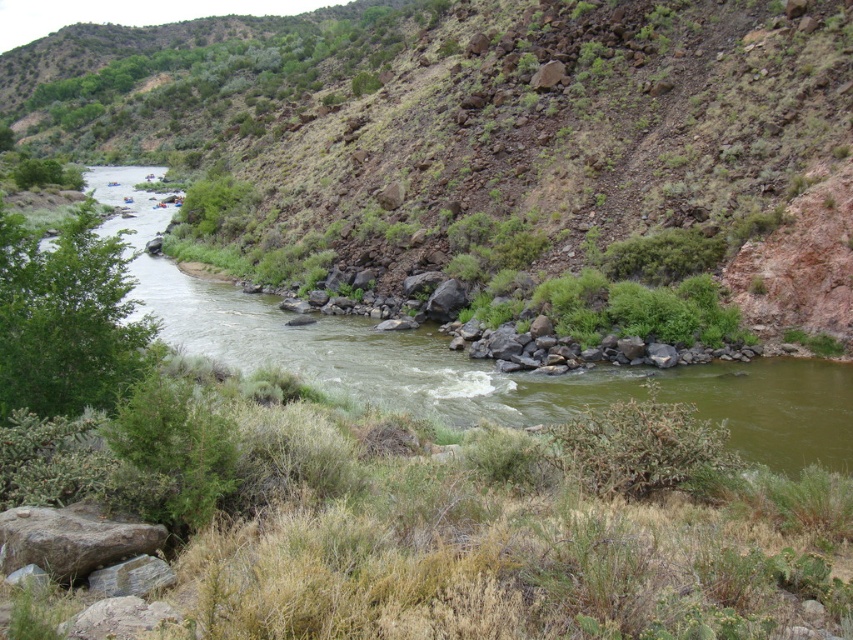
You are planning to cross the river using a small boat. You see the green grassy hillside at upper left and the green water at left. Which direction should you head towards to avoid the rapids near the center?

You should head towards the green grassy hillside at upper left because it is positioned on the left side of the green water at left, which is away from the rapids near the center.

You are navigating a drone that needs to capture a closeup of the green grassy hillside at upper left. According to the coordinates provided, where should you position the drone to ensure it is directly above the hillside?

The green grassy hillside at upper left is located at point [492,150], so you should position the drone directly above those coordinates to capture the closeup.

You are a hiker planning to cross the river using the green water at left. You notice the green grassy hillside at upper left. Which object is closer to you as you stand on the riverbank?

The green grassy hillside at upper left is closer to you than the green water at left because it is further to the viewer.